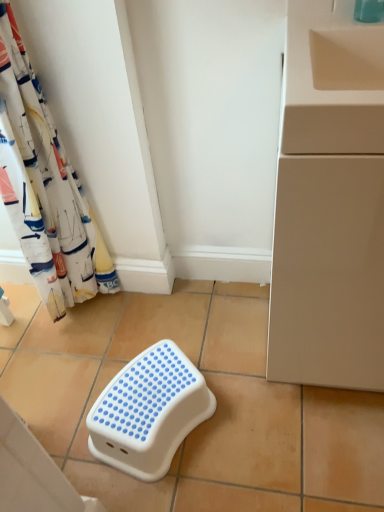
Question: From a real-world perspective, is white fabric curtain at left positioned under white plastic step stool at center based on gravity?

Choices:
 (A) no
 (B) yes

Answer: (A)

Question: Is white fabric curtain at left smaller than white plastic step stool at center?

Choices:
 (A) no
 (B) yes

Answer: (A)

Question: Is white fabric curtain at left bigger than white plastic step stool at center?

Choices:
 (A) no
 (B) yes

Answer: (B)

Question: Does white fabric curtain at left come in front of white plastic step stool at center?

Choices:
 (A) no
 (B) yes

Answer: (B)

Question: Is the position of white fabric curtain at left more distant than that of white plastic step stool at center?

Choices:
 (A) no
 (B) yes

Answer: (A)

Question: In the image, is beige ceramic tile at lower left, placed as the 1th ceramic tile when sorted from left to right, positioned in front of or behind white plastic step stool at center?

Choices:
 (A) front
 (B) behind

Answer: (A)

Question: Is point (48, 376) positioned closer to the camera than point (129, 420)?

Choices:
 (A) closer
 (B) farther

Answer: (B)

Question: From a real-world perspective, is beige ceramic tile at lower left, acting as the 2th ceramic tile starting from the right, physically located above or below white plastic step stool at center?

Choices:
 (A) below
 (B) above

Answer: (B)

Question: From the image's perspective, relative to white plastic step stool at center, is beige ceramic tile at lower left, acting as the 2th ceramic tile starting from the right, above or below?

Choices:
 (A) below
 (B) above

Answer: (B)

Question: Considering the positions of beige matte cabinet at right and white plastic step stool at center in the image, is beige matte cabinet at right wider or thinner than white plastic step stool at center?

Choices:
 (A) thin
 (B) wide

Answer: (B)

Question: Is point [x=274, y=258] closer or farther from the camera than point [x=119, y=417]?

Choices:
 (A) farther
 (B) closer

Answer: (B)

Question: In the image, is beige matte cabinet at right positioned in front of or behind white plastic step stool at center?

Choices:
 (A) front
 (B) behind

Answer: (A)

Question: Is beige matte cabinet at right taller or shorter than white plastic step stool at center?

Choices:
 (A) tall
 (B) short

Answer: (A)

Question: Relative to beige ceramic tile at lower left, placed as the 1th ceramic tile when sorted from left to right, is white fabric curtain at left in front or behind?

Choices:
 (A) behind
 (B) front

Answer: (B)

Question: From the image's perspective, is white fabric curtain at left positioned above or below beige ceramic tile at lower left, acting as the 2th ceramic tile starting from the right?

Choices:
 (A) below
 (B) above

Answer: (B)